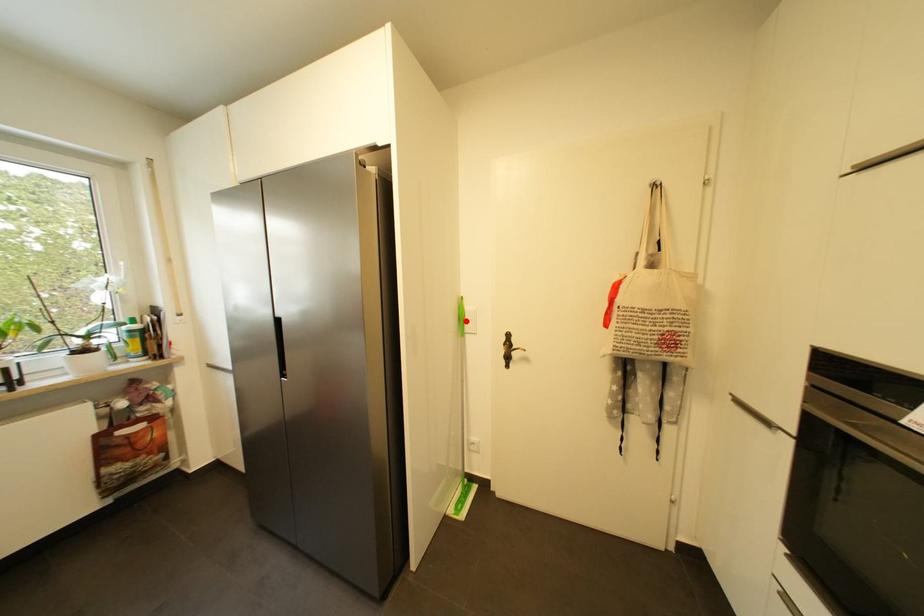
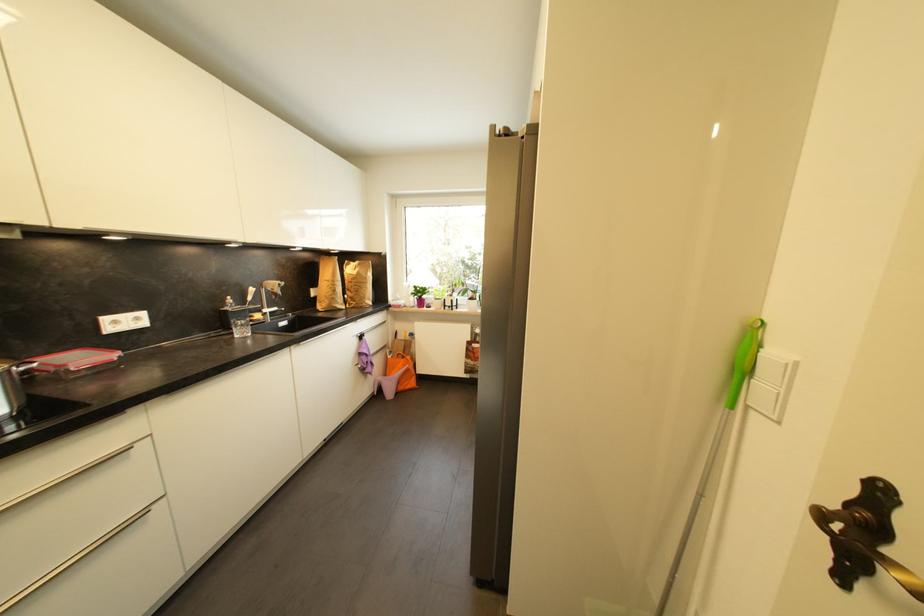
Question: I am providing you with two images of the same scene from different viewpoints. A red point is marked on the first image. At the location where the point appears in image 1, is it still visible in image 2?

Choices:
 (A) Yes
 (B) No

Answer: (A)